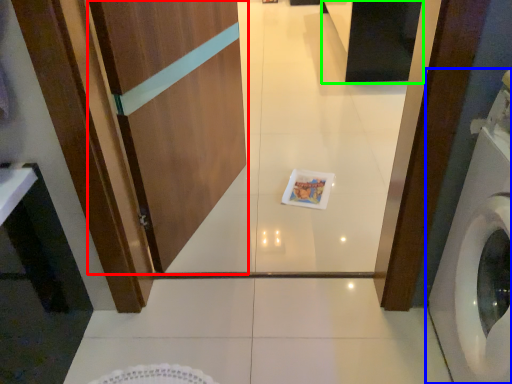
Question: Which object is positioned closest to screen door (highlighted by a red box)? Select from washing machine (highlighted by a blue box) and cabinetry (highlighted by a green box).

Choices:
 (A) washing machine
 (B) cabinetry

Answer: (A)